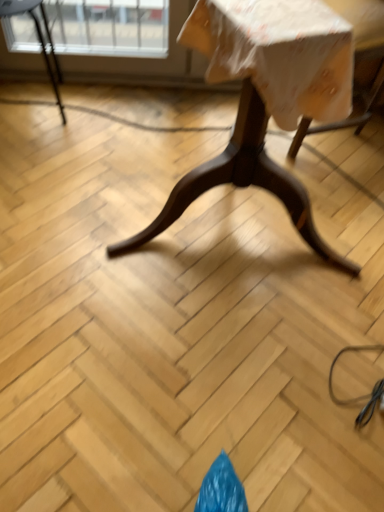
I want to click on wooden swivel chair at upper right, so click(356, 62).

The image size is (384, 512). In order to click on wooden swivel chair at upper right in this screenshot , I will do pos(356,62).

From the image's perspective, does wooden table at center appear higher than metallic black chair at upper left?

No, from the image's perspective, wooden table at center is not over metallic black chair at upper left.

Considering the relative sizes of wooden table at center and metallic black chair at upper left in the image provided, is wooden table at center thinner than metallic black chair at upper left?

No.

Relative to metallic black chair at upper left, is wooden table at center in front or behind?

wooden table at center is in front of metallic black chair at upper left.

From a real-world perspective, does wooden table at center stand above metallic black chair at upper left?

Indeed, from a real-world perspective, wooden table at center stands above metallic black chair at upper left.

Considering the relative sizes of wooden swivel chair at upper right and wooden table at center in the image provided, is wooden swivel chair at upper right smaller than wooden table at center?

Yes, wooden swivel chair at upper right is smaller than wooden table at center.

Is wooden swivel chair at upper right touching wooden table at center?

No, wooden swivel chair at upper right is not touching wooden table at center.

Which is in front, wooden swivel chair at upper right or wooden table at center?

wooden table at center.

Does wooden swivel chair at upper right have a lesser width compared to wooden table at center?

Correct, the width of wooden swivel chair at upper right is less than that of wooden table at center.

Considering the sizes of objects metallic black chair at upper left and wooden table at center in the image provided, who is taller, metallic black chair at upper left or wooden table at center?

With more height is wooden table at center.

Looking at this image, can you see metallic black chair at upper left touching wooden table at center?

No.

Which object is closer to the camera, metallic black chair at upper left or wooden table at center?

wooden table at center is closer to the camera.

From a real-world perspective, is metallic black chair at upper left above or below wooden table at center?

metallic black chair at upper left is situated lower than wooden table at center in the real world.

Can you tell me how much metallic black chair at upper left and wooden swivel chair at upper right differ in facing direction?

70.1 degrees separate the facing orientations of metallic black chair at upper left and wooden swivel chair at upper right.

Is metallic black chair at upper left taller than wooden swivel chair at upper right?

No, metallic black chair at upper left is not taller than wooden swivel chair at upper right.

Between metallic black chair at upper left and wooden swivel chair at upper right, which one has smaller size?

metallic black chair at upper left.

From the image's perspective, would you say metallic black chair at upper left is positioned over wooden swivel chair at upper right?

Yes, from the image's perspective, metallic black chair at upper left is on top of wooden swivel chair at upper right.

Does point (128, 250) appear closer or farther from the camera than point (377, 51)?

Clearly, point (128, 250) is closer to the camera than point (377, 51).

Does wooden table at center have a greater height compared to wooden swivel chair at upper right?

Correct, wooden table at center is much taller as wooden swivel chair at upper right.

Is the surface of wooden table at center in direct contact with wooden swivel chair at upper right?

wooden table at center is not next to wooden swivel chair at upper right, and they're not touching.

What's the angular difference between wooden table at center and wooden swivel chair at upper right's facing directions?

They differ by 81.1 degrees in their facing directions.

Considering their positions, is wooden swivel chair at upper right located in front of or behind metallic black chair at upper left?

In the image, wooden swivel chair at upper right appears in front of metallic black chair at upper left.

How many degrees apart are the facing directions of wooden swivel chair at upper right and metallic black chair at upper left?

There is a 70.1-degree angle between the facing directions of wooden swivel chair at upper right and metallic black chair at upper left.

From the image's perspective, is wooden swivel chair at upper right above or below metallic black chair at upper left?

From the image's perspective, wooden swivel chair at upper right appears below metallic black chair at upper left.

From a real-world perspective, is wooden swivel chair at upper right located beneath metallic black chair at upper left?

No, from a real-world perspective, wooden swivel chair at upper right is not beneath metallic black chair at upper left.

I want to click on table in front of the metallic black chair at upper left, so click(x=266, y=98).

Locate an element on the screen. The height and width of the screenshot is (512, 384). table below the wooden swivel chair at upper right (from the image's perspective) is located at coordinates (266, 98).

Based on their spatial positions, is wooden swivel chair at upper right or wooden table at center further from metallic black chair at upper left?

Based on the image, wooden table at center appears to be further to metallic black chair at upper left.

Estimate the real-world distances between objects in this image. Which object is closer to wooden table at center, wooden swivel chair at upper right or metallic black chair at upper left?

Among the two, wooden swivel chair at upper right is located nearer to wooden table at center.

Considering their positions, is metallic black chair at upper left positioned closer to wooden table at center than wooden swivel chair at upper right?

wooden swivel chair at upper right.

When comparing their distances from wooden swivel chair at upper right, does wooden table at center or metallic black chair at upper left seem further?

metallic black chair at upper left is further to wooden swivel chair at upper right.

Looking at this image, considering their positions, is metallic black chair at upper left positioned closer to wooden swivel chair at upper right than wooden table at center?

wooden table at center is closer to wooden swivel chair at upper right.

From the image, which object appears to be nearer to metallic black chair at upper left, wooden table at center or wooden swivel chair at upper right?

Among the two, wooden swivel chair at upper right is located nearer to metallic black chair at upper left.

The height and width of the screenshot is (512, 384). I want to click on table between metallic black chair at upper left and wooden swivel chair at upper right from left to right, so click(x=266, y=98).